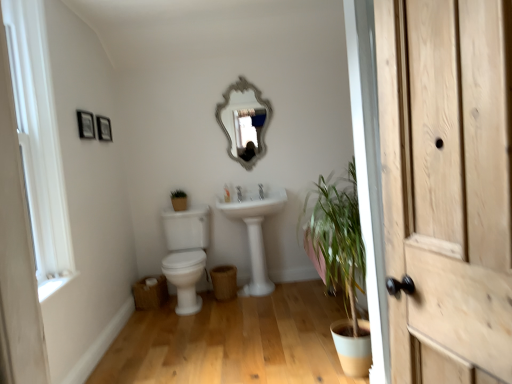
Question: Is white painted wood window frame at left shorter than silver/glass mirror at upper center?

Choices:
 (A) yes
 (B) no

Answer: (B)

Question: From the image's perspective, is white painted wood window frame at left located above silver/glass mirror at upper center?

Choices:
 (A) no
 (B) yes

Answer: (A)

Question: Could you tell me if white painted wood window frame at left is facing silver/glass mirror at upper center?

Choices:
 (A) yes
 (B) no

Answer: (B)

Question: From a real-world perspective, is white painted wood window frame at left positioned over silver/glass mirror at upper center based on gravity?

Choices:
 (A) no
 (B) yes

Answer: (A)

Question: Is white painted wood window frame at left closer to camera compared to silver/glass mirror at upper center?

Choices:
 (A) yes
 (B) no

Answer: (A)

Question: Does point (182, 236) appear closer or farther from the camera than point (261, 201)?

Choices:
 (A) closer
 (B) farther

Answer: (B)

Question: Considering the relative positions of white glossy toilet at center-left and white glossy sink at center in the image provided, is white glossy toilet at center-left to the left or to the right of white glossy sink at center?

Choices:
 (A) left
 (B) right

Answer: (A)

Question: Is white glossy toilet at center-left taller or shorter than white glossy sink at center?

Choices:
 (A) short
 (B) tall

Answer: (A)

Question: Is white glossy toilet at center-left spatially inside white glossy sink at center, or outside of it?

Choices:
 (A) outside
 (B) inside

Answer: (A)

Question: Is white glossy sink at center to the left or to the right of silver/glass mirror at upper center in the image?

Choices:
 (A) left
 (B) right

Answer: (B)

Question: Is point (258, 288) closer or farther from the camera than point (221, 109)?

Choices:
 (A) farther
 (B) closer

Answer: (B)

Question: In terms of height, does white glossy sink at center look taller or shorter compared to silver/glass mirror at upper center?

Choices:
 (A) short
 (B) tall

Answer: (B)

Question: Is white glossy sink at center inside or outside of silver/glass mirror at upper center?

Choices:
 (A) inside
 (B) outside

Answer: (B)

Question: Does point [173, 249] appear closer or farther from the camera than point [262, 187]?

Choices:
 (A) closer
 (B) farther

Answer: (A)

Question: From the image's perspective, relative to white ceramic tap at center, is white glossy toilet at center-left above or below?

Choices:
 (A) above
 (B) below

Answer: (B)